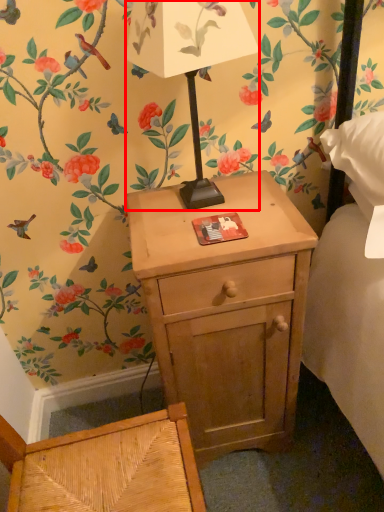
Question: Observing the image, what is the correct spatial positioning of table lamp (annotated by the red box) in reference to nightstand?

Choices:
 (A) left
 (B) right

Answer: (A)